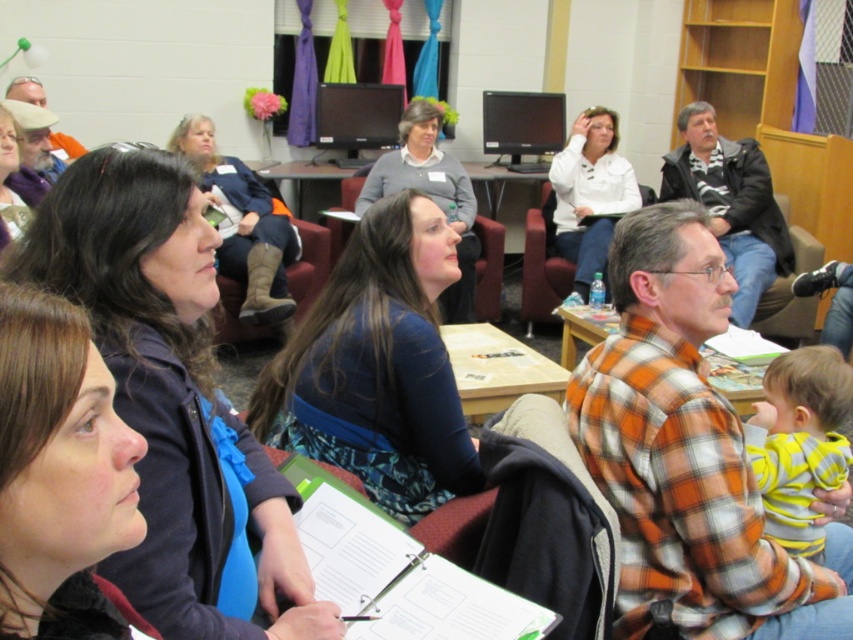
Question: Is yellow striped shirt at lower right to the right of dark blue sweater at center from the viewer's perspective?

Choices:
 (A) no
 (B) yes

Answer: (B)

Question: Estimate the real-world distances between objects in this image. Which object is closer to the matte blue dress at center?

Choices:
 (A) white plastic clipboard at center
 (B) dark blue sweater at center

Answer: (A)

Question: Does matte blue dress at center have a smaller size compared to dark blue sweater at center?

Choices:
 (A) yes
 (B) no

Answer: (A)

Question: Does yellow striped shirt at lower right appear on the right side of dark blue sweater at center?

Choices:
 (A) no
 (B) yes

Answer: (B)

Question: Which of these objects is positioned farthest from the dark blue sweater at center?

Choices:
 (A) white plastic clipboard at center
 (B) white matte shirt at upper center
 (C) brown matte hair at center
 (D) yellow striped shirt at lower right

Answer: (C)

Question: Which object is closer to the camera taking this photo?

Choices:
 (A) orange plaid shirt at right
 (B) orange plaid shirt at center
 (C) blue fabric dress at center
 (D) wooden chair at center

Answer: (A)